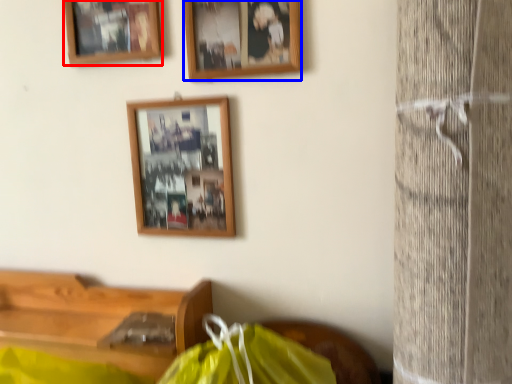
Question: Which object is further to the camera taking this photo, picture frame (highlighted by a red box) or picture frame (highlighted by a blue box)?

Choices:
 (A) picture frame
 (B) picture frame

Answer: (A)